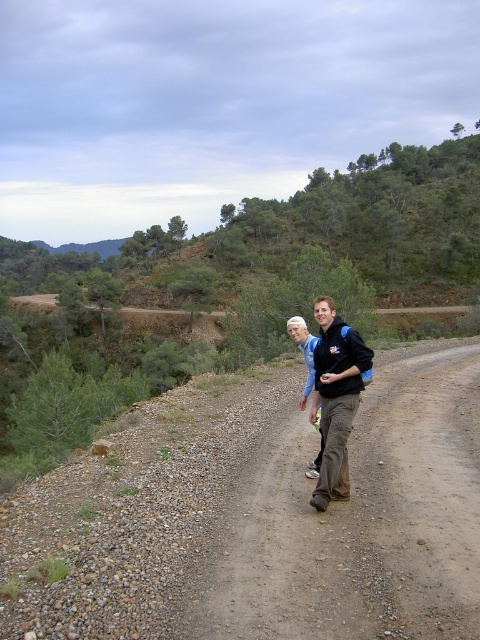
Question: Does brown dirt trail at center appear on the right side of black softshell jacket at center?

Choices:
 (A) no
 (B) yes

Answer: (B)

Question: Can you confirm if brown dirt trail at center is bigger than black softshell jacket at center?

Choices:
 (A) yes
 (B) no

Answer: (A)

Question: Is brown dirt trail at center above dark blue jacket at center?

Choices:
 (A) yes
 (B) no

Answer: (B)

Question: Which object appears closest to the camera in this image?

Choices:
 (A) dark blue jacket at center
 (B) black softshell jacket at center
 (C) brown dirt trail at center

Answer: (C)

Question: Which of the following is the closest to the observer?

Choices:
 (A) click(x=430, y=484)
 (B) click(x=316, y=403)

Answer: (A)

Question: Among these points, which one is farthest from the camera?

Choices:
 (A) (311, 344)
 (B) (321, 397)

Answer: (A)